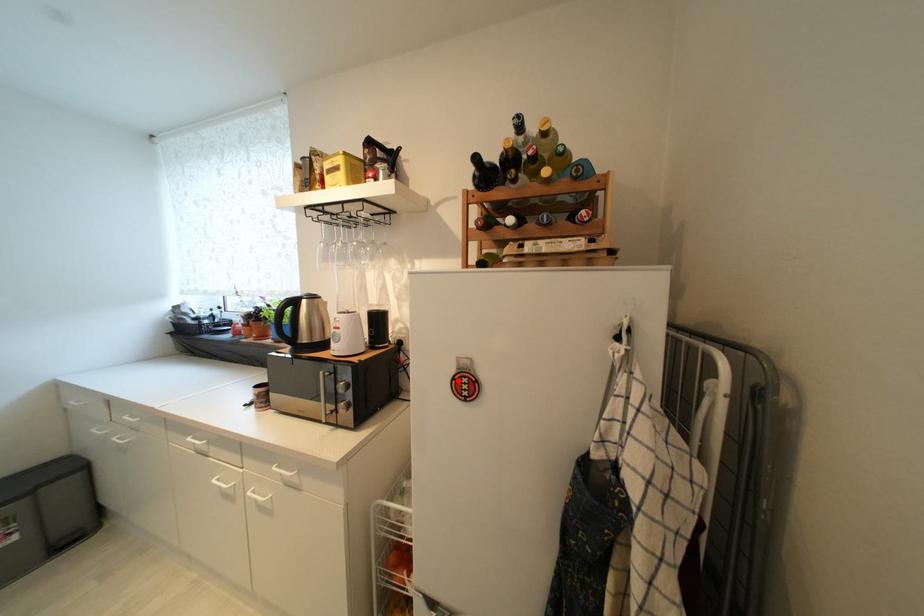
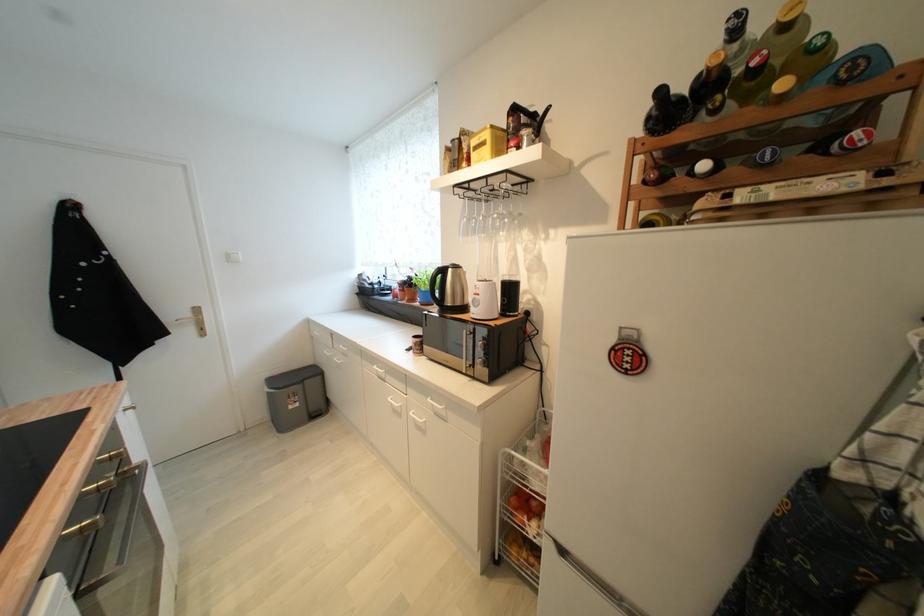
Find the pixel in the second image that matches the highlighted location in the first image.

(618, 351)